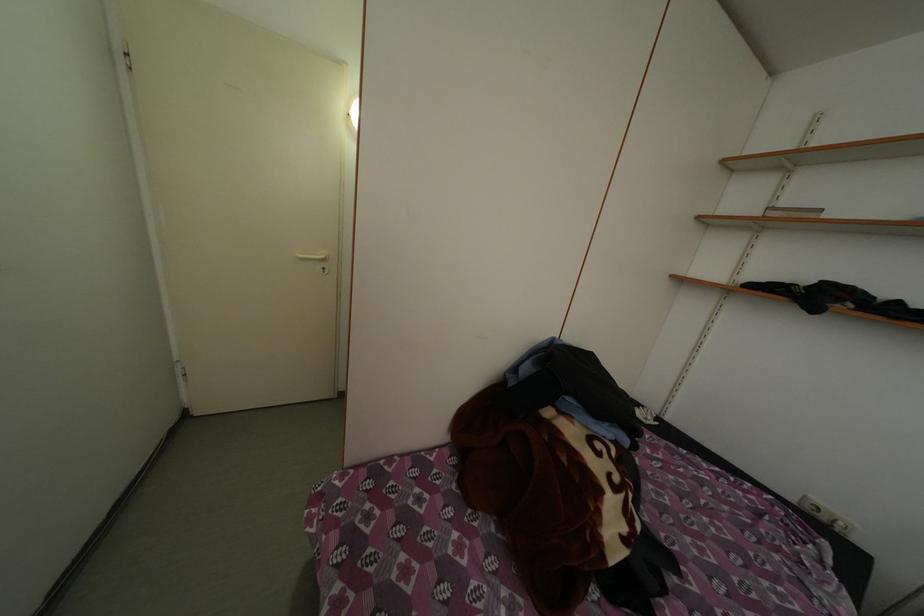
Describe the element at coordinates (793, 212) in the screenshot. I see `the small white book` at that location.